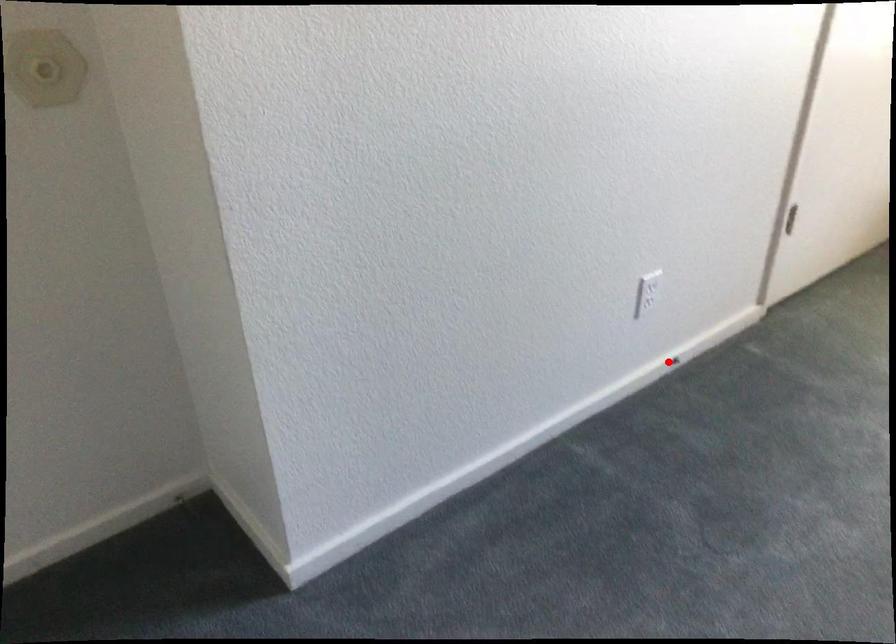
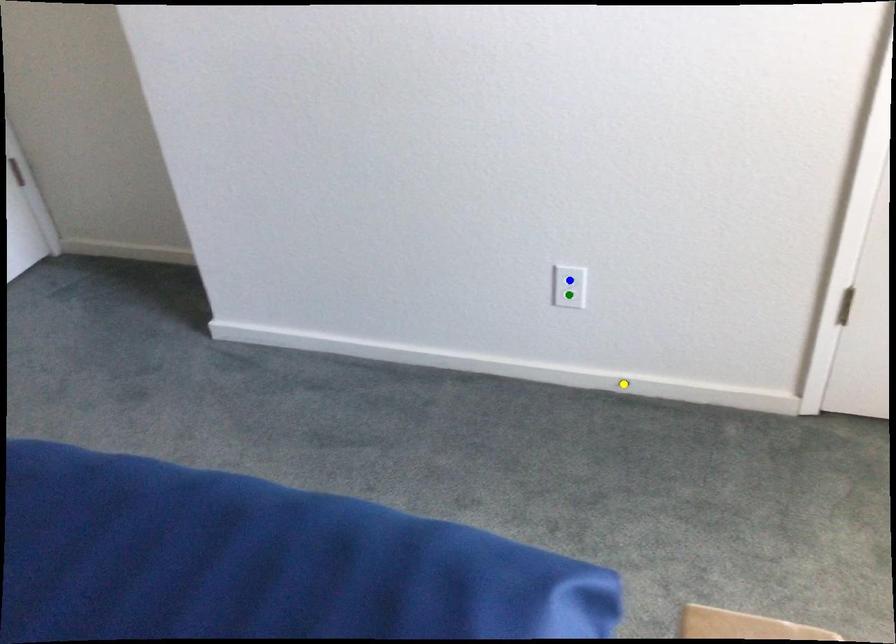
Question: I am providing you with two images of the same scene from different viewpoints. A red point is marked on the first image. You are given multiple points on the second image. Can you choose the point in image 2 that corresponds to the point in image 1?

Choices:
 (A) green point
 (B) yellow point
 (C) blue point

Answer: (B)